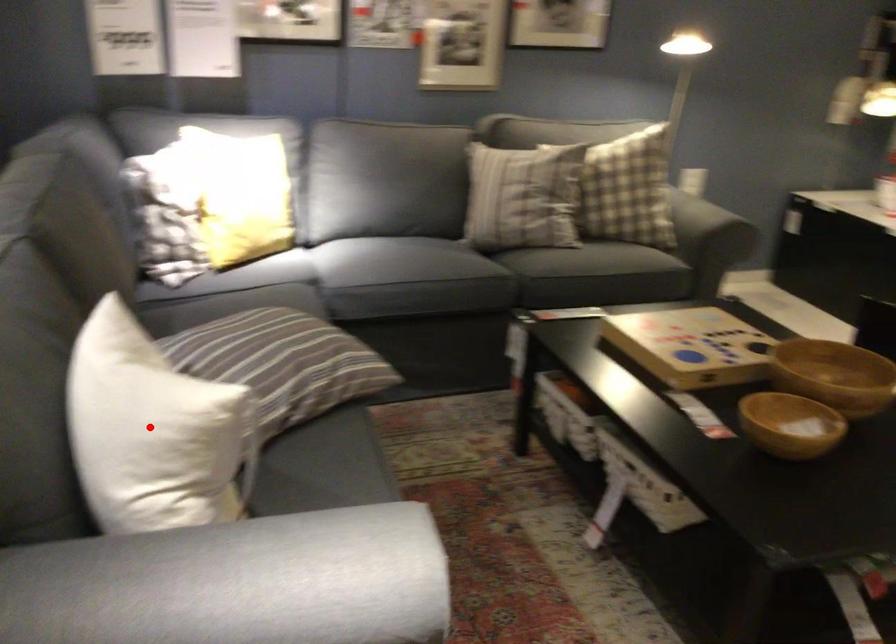
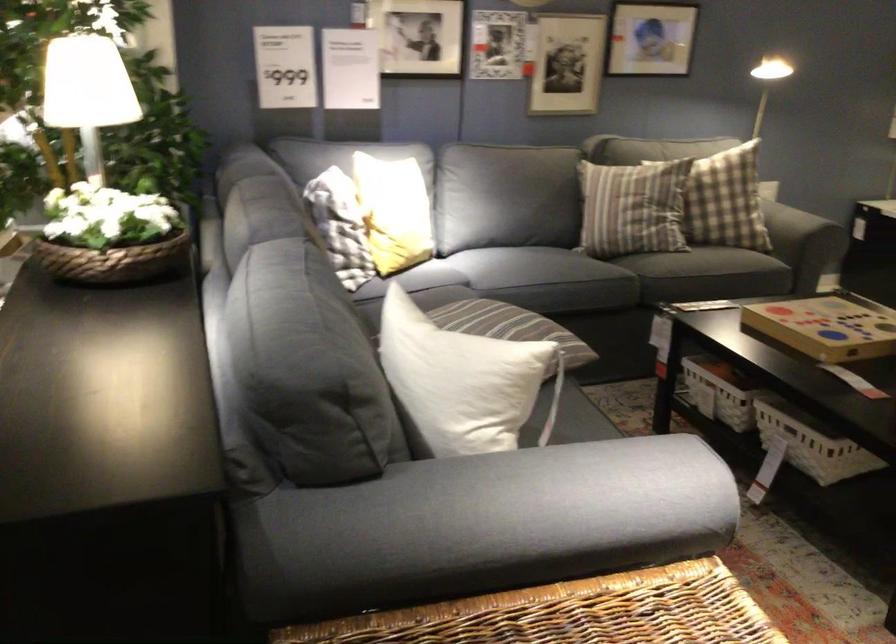
Question: I am providing you with two images of the same scene from different viewpoints. A red point is shown in image1. For the corresponding object point in image2, is it positioned nearer or farther from the camera?

Choices:
 (A) Nearer
 (B) Farther

Answer: (B)